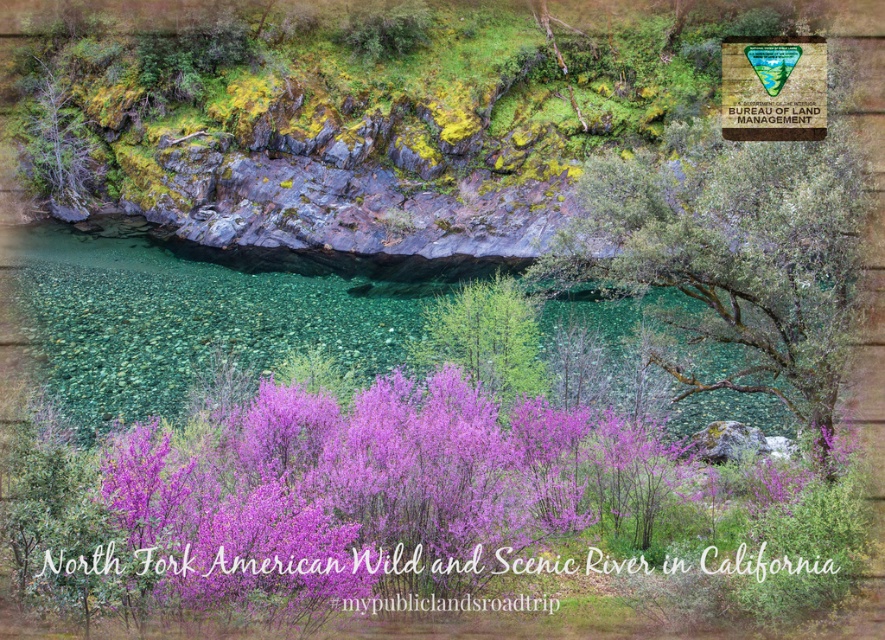
You are a botanist observing the North Fork American Wild and Scenic River area. You notice two purple plants in the center of the scene. Which one is taller, the purple bloom at center or the purple leafy tree at center?

The purple leafy tree at center is taller than the purple bloom at center.